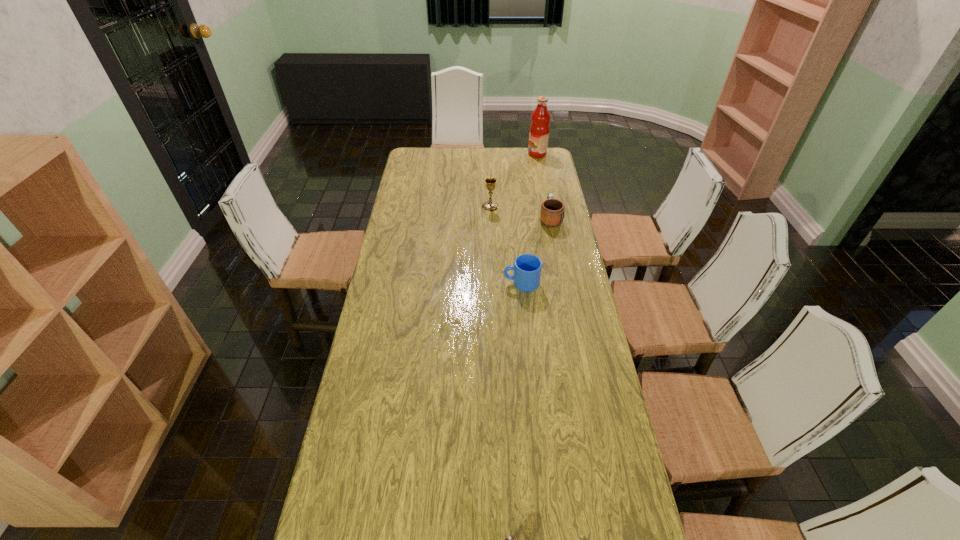
The height and width of the screenshot is (540, 960). What are the coordinates of `the farthest object` in the screenshot? It's located at (539, 129).

Find the location of a particular element. This screenshot has width=960, height=540. the tallest object is located at coordinates (539, 129).

In order to click on the second tallest object in this screenshot , I will do `click(490, 205)`.

Locate an element on the screen. the fourth farthest object is located at coordinates (527, 268).

At what (x,y) coordinates should I click in order to perform the action: click on the nearer mug. Please return your answer as a coordinate pair (x, y). The width and height of the screenshot is (960, 540). Looking at the image, I should click on (527, 268).

I want to click on the farther mug, so click(552, 210).

Locate an element on the screen. The height and width of the screenshot is (540, 960). vacant space located on the front label of the tallest object is located at coordinates (501, 154).

What are the coordinates of `free region located 0.130m on the front label of the tallest object` in the screenshot? It's located at (503, 154).

This screenshot has height=540, width=960. Identify the location of free space located 0.050m on the front label of the tallest object. (518, 154).

Locate an element on the screen. This screenshot has height=540, width=960. blank space located on the front of the fourth shortest object is located at coordinates (491, 218).